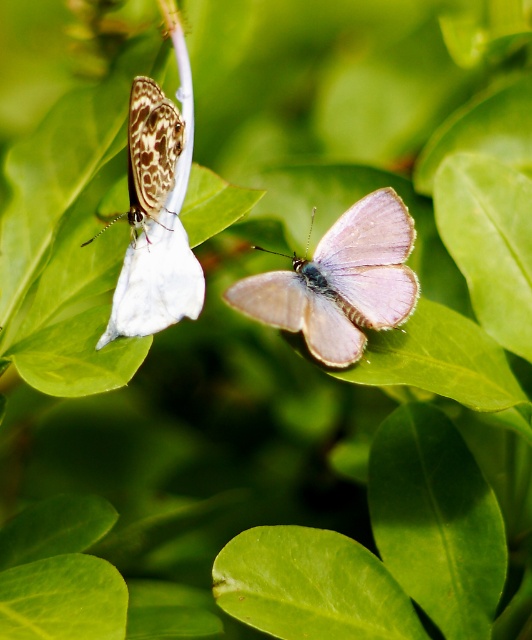
Does white matte paper at left have a larger size compared to green smooth leaf at lower left?

Indeed, white matte paper at left has a larger size compared to green smooth leaf at lower left.

You are a GUI agent. You are given a task and a screenshot of the screen. Output one action in this format:
    pyautogui.click(x=<x>, y=<y>)
    Task: Click on the white matte paper at left
    Image resolution: width=532 pixels, height=640 pixels.
    Given the screenshot: What is the action you would take?
    pyautogui.click(x=162, y=237)

Is point (54, 604) farther from viewer compared to point (138, 132)?

No, (54, 604) is in front of (138, 132).

Is green smooth leaf at lower left positioned in front of speckled brown butterfly at upper left?

Yes, green smooth leaf at lower left is in front of speckled brown butterfly at upper left.

Identify the location of green smooth leaf at lower left. (62, 600).

Does green smooth leaf at center appear on the left side of green smooth leaf at lower left?

No, green smooth leaf at center is not to the left of green smooth leaf at lower left.

Between green smooth leaf at center and green smooth leaf at lower left, which one is positioned higher?

green smooth leaf at lower left

Identify the location of green smooth leaf at center. The height and width of the screenshot is (640, 532). (311, 586).